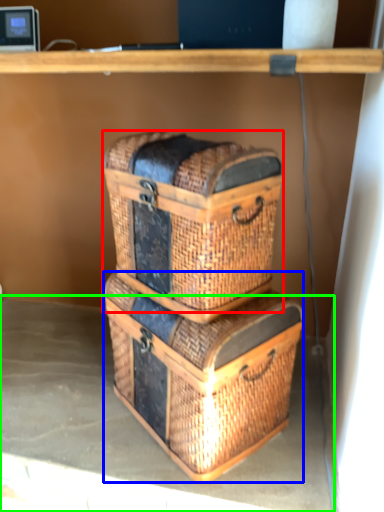
Question: Based on their relative distances, which object is farther from basket container (highlighted by a red box)? Choose from crate (highlighted by a blue box) and concrete (highlighted by a green box).

Choices:
 (A) crate
 (B) concrete

Answer: (B)